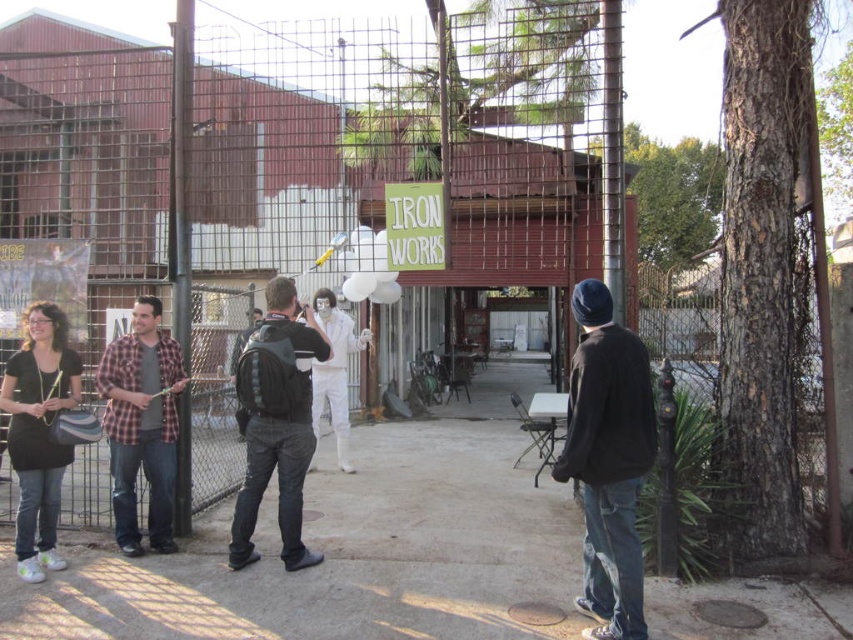
Does dark blue knit cap at right appear on the right side of white matte suit at center?

Indeed, dark blue knit cap at right is positioned on the right side of white matte suit at center.

Which is more to the left, dark blue knit cap at right or white matte suit at center?

white matte suit at center

What are the coordinates of `dark blue knit cap at right` in the screenshot? It's located at (608, 460).

Is black backpack at center further to camera compared to matte black shirt at lower left?

No, black backpack at center is in front of matte black shirt at lower left.

Between black backpack at center and matte black shirt at lower left, which one is positioned higher?

Result: Positioned higher is black backpack at center.

The image size is (853, 640). What do you see at coordinates (277, 422) in the screenshot? I see `black backpack at center` at bounding box center [277, 422].

Locate an element on the screen. This screenshot has width=853, height=640. black backpack at center is located at coordinates (277, 422).

Between black backpack at center and white matte suit at center, which one has less height?

black backpack at center is shorter.

Between point (260, 422) and point (347, 424), which one is positioned in front?

Positioned in front is point (260, 422).

Where is `black backpack at center`? The height and width of the screenshot is (640, 853). black backpack at center is located at coordinates (277, 422).

Identify the location of black backpack at center. This screenshot has width=853, height=640. (277, 422).